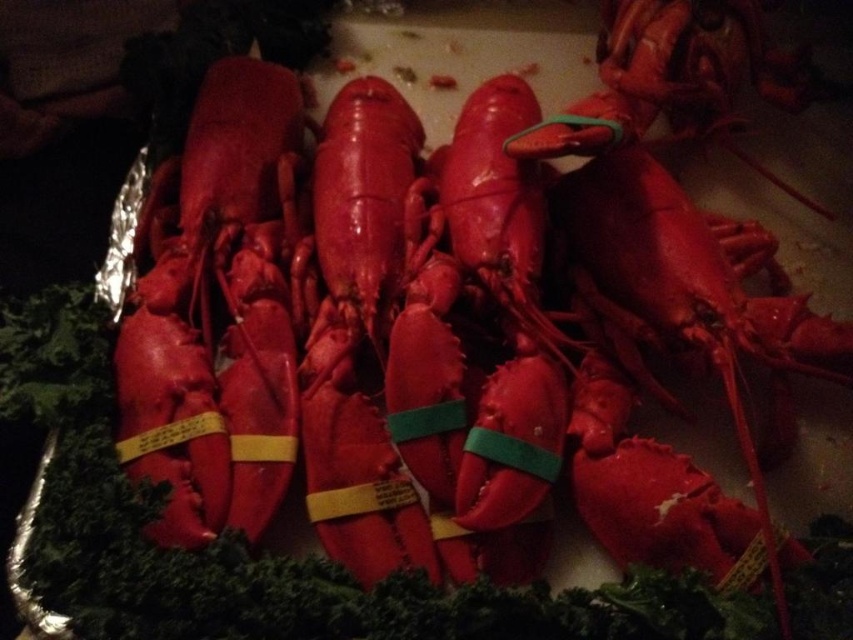
Is shiny red lobster at left positioned before glossy red lobster at center?

No, it is not.

You are a GUI agent. You are given a task and a screenshot of the screen. Output one action in this format:
    pyautogui.click(x=<x>, y=<y>)
    Task: Click on the shiny red lobster at left
    
    Given the screenshot: What is the action you would take?
    pyautogui.click(x=216, y=310)

Find the location of a particular element. This screenshot has height=640, width=853. shiny red lobster at left is located at coordinates (216, 310).